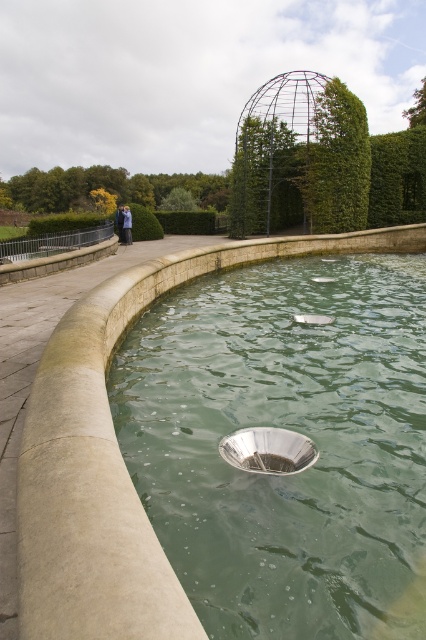
Does green leafy hedge at upper right appear over silver metallic bowl at center?

Yes.

Who is higher up, green leafy hedge at upper right or silver metallic bowl at center?

green leafy hedge at upper right

Locate an element on the screen. This screenshot has height=640, width=426. green leafy hedge at upper right is located at coordinates (397, 177).

Where is `green leafy hedge at upper right`? green leafy hedge at upper right is located at coordinates (397, 177).

Is metallic silver pool at center further to camera compared to green leafy hedge at upper right?

No.

Can you confirm if metallic silver pool at center is taller than green leafy hedge at upper right?

No.

Is point (319, 513) in front of point (419, 125)?

Yes, point (319, 513) is closer to viewer.

In order to click on metallic silver pool at center in this screenshot , I will do `click(284, 428)`.

From the picture: Can you confirm if metallic silver pool at center is thinner than green leafy hedge at upper center?

In fact, metallic silver pool at center might be wider than green leafy hedge at upper center.

Is point (340, 344) less distant than point (357, 193)?

Yes, it is in front of point (357, 193).

Image resolution: width=426 pixels, height=640 pixels. What are the coordinates of `metallic silver pool at center` in the screenshot? It's located at (284, 428).